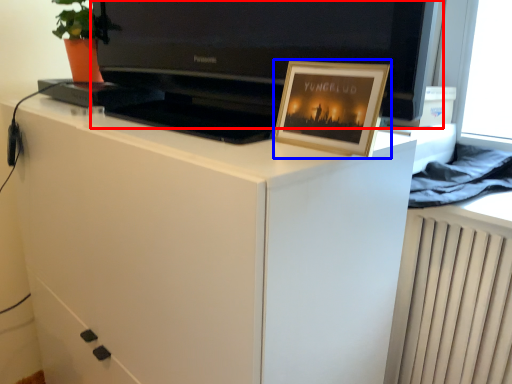
Question: Among these objects, which one is nearest to the camera, television (highlighted by a red box) or picture frame (highlighted by a blue box)?

Choices:
 (A) television
 (B) picture frame

Answer: (A)